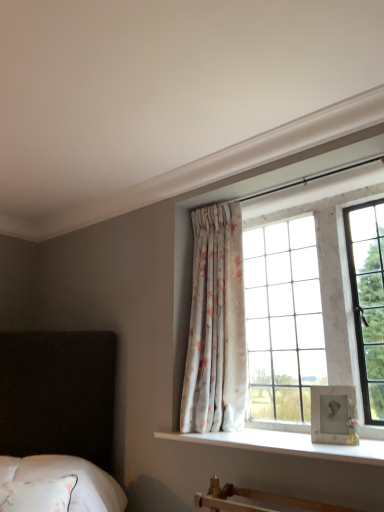
Question: Are floral fabric curtain at center and white textured glass at upper right located far from each other?

Choices:
 (A) no
 (B) yes

Answer: (A)

Question: Is floral fabric curtain at center completely or partially outside of white textured glass at upper right?

Choices:
 (A) no
 (B) yes

Answer: (B)

Question: From the image's perspective, is floral fabric curtain at center located beneath white textured glass at upper right?

Choices:
 (A) yes
 (B) no

Answer: (A)

Question: Considering the relative positions of floral fabric curtain at center and white textured glass at upper right in the image provided, is floral fabric curtain at center behind white textured glass at upper right?

Choices:
 (A) yes
 (B) no

Answer: (A)

Question: Can you confirm if floral fabric curtain at center is shorter than white textured glass at upper right?

Choices:
 (A) yes
 (B) no

Answer: (B)

Question: Does floral fabric curtain at center have a greater height compared to white textured glass at upper right?

Choices:
 (A) yes
 (B) no

Answer: (A)

Question: Does white textured glass at upper right have a lesser width compared to white smooth window sill at center?

Choices:
 (A) no
 (B) yes

Answer: (B)

Question: From a real-world perspective, is white textured glass at upper right below white smooth window sill at center?

Choices:
 (A) yes
 (B) no

Answer: (B)

Question: Is white textured glass at upper right shorter than white smooth window sill at center?

Choices:
 (A) no
 (B) yes

Answer: (A)

Question: Is white textured glass at upper right completely or partially outside of white smooth window sill at center?

Choices:
 (A) no
 (B) yes

Answer: (B)

Question: From the image's perspective, does white textured glass at upper right appear higher than white smooth window sill at center?

Choices:
 (A) yes
 (B) no

Answer: (A)

Question: Can you confirm if white textured glass at upper right is taller than white smooth window sill at center?

Choices:
 (A) yes
 (B) no

Answer: (A)

Question: Can floral fabric curtain at center be found inside white soft bedding at lower left?

Choices:
 (A) yes
 (B) no

Answer: (B)